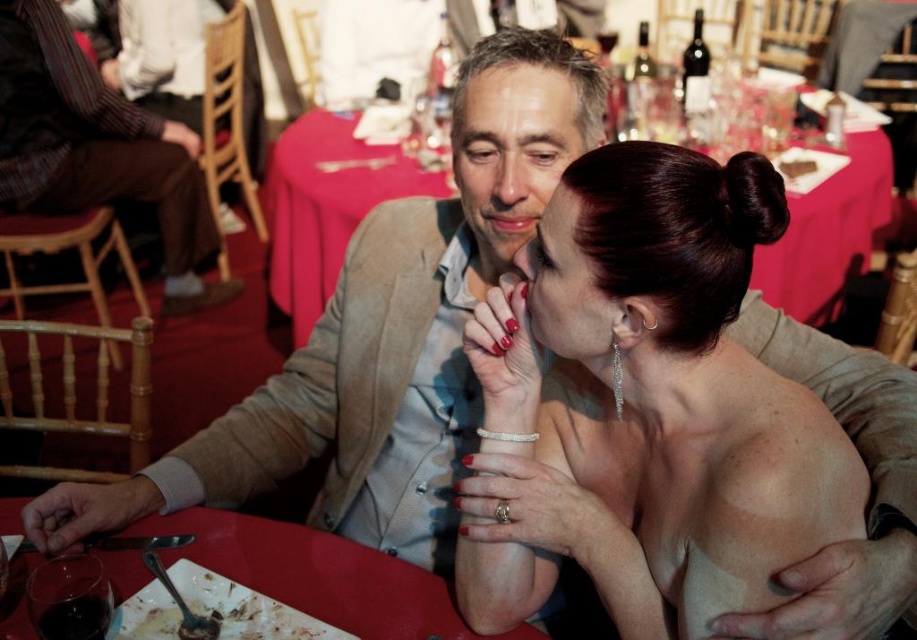
Question: Can you confirm if shiny silver earrings at center is positioned below striped fabric pants at left?

Choices:
 (A) yes
 (B) no

Answer: (A)

Question: Which object is closer to the camera taking this photo?

Choices:
 (A) striped fabric pants at left
 (B) shiny silver earrings at center
 (C) smooth red table at center
 (D) smooth red tablecloth at center

Answer: (B)

Question: Is smooth red tablecloth at center wider than smooth red table at center?

Choices:
 (A) yes
 (B) no

Answer: (B)

Question: Which point is farther from the camera taking this photo?

Choices:
 (A) (658, 275)
 (B) (57, 180)

Answer: (B)

Question: Which of these objects is positioned closest to the striped fabric pants at left?

Choices:
 (A) shiny silver earrings at center
 (B) smooth red tablecloth at center
 (C) smooth red table at center

Answer: (B)

Question: Is striped fabric pants at left positioned behind smooth red tablecloth at center?

Choices:
 (A) no
 (B) yes

Answer: (B)